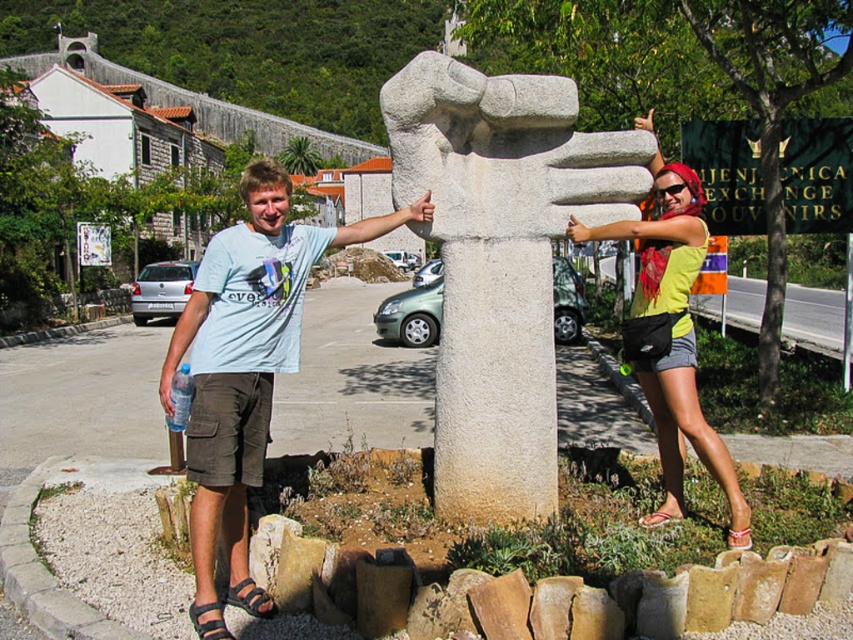
Question: Is the position of white stone sculpture at center more distant than that of yellow-green fabric bag at upper right?

Choices:
 (A) no
 (B) yes

Answer: (B)

Question: Among these points, which one is nearest to the camera?

Choices:
 (A) (252, 244)
 (B) (669, 200)
 (C) (485, 166)
 (D) (477, 499)

Answer: (A)

Question: Is matte stone statue at center above white stone sculpture at center?

Choices:
 (A) no
 (B) yes

Answer: (A)

Question: Which point appears farthest from the camera in this image?

Choices:
 (A) (189, 445)
 (B) (672, 429)
 (C) (683, 250)

Answer: (B)

Question: Which object appears closest to the camera in this image?

Choices:
 (A) light blue t-shirt at center
 (B) matte stone statue at center

Answer: (A)

Question: Is light blue t-shirt at center wider than yellow-green fabric bag at upper right?

Choices:
 (A) no
 (B) yes

Answer: (B)